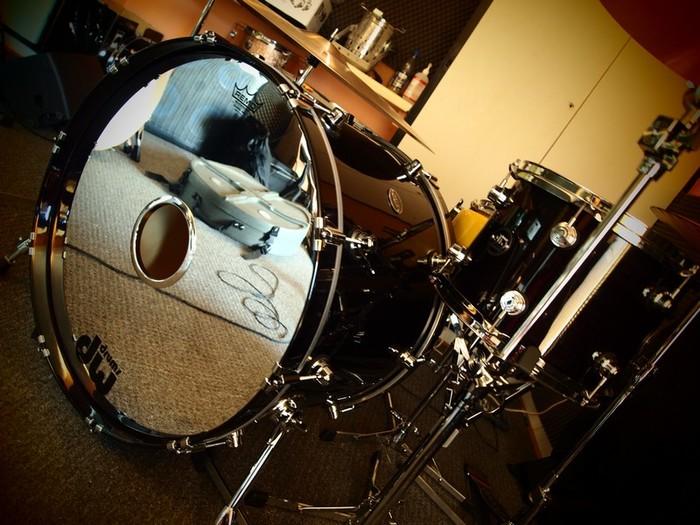
In order to click on counter in this screenshot , I will do `click(328, 36)`.